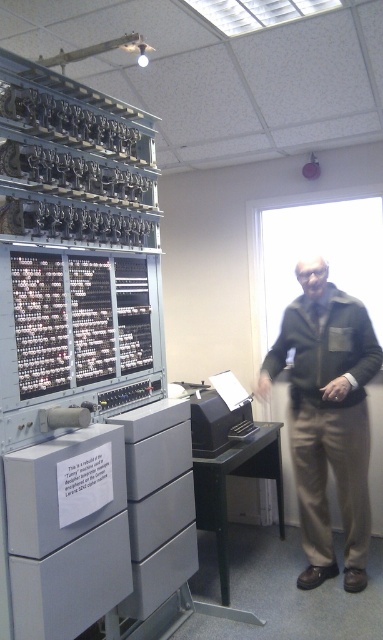
Between gray plastic drawer at lower center and black plastic printer at center, which one has less height?

With less height is gray plastic drawer at lower center.

Is gray plastic drawer at lower center to the right of black plastic printer at center from the viewer's perspective?

No, gray plastic drawer at lower center is not to the right of black plastic printer at center.

This screenshot has width=383, height=640. What are the coordinates of `gray plastic drawer at lower center` in the screenshot? It's located at (160, 573).

Is khaki cotton pants at right thinner than black plastic printer at center?

No.

Does khaki cotton pants at right appear on the left side of black plastic printer at center?

No, khaki cotton pants at right is not to the left of black plastic printer at center.

Is point (374, 333) farther from camera compared to point (222, 438)?

No, it is not.

The image size is (383, 640). Identify the location of khaki cotton pants at right. (327, 417).

Which is above, satin gray drawer at center or black plastic printer at center?

Positioned higher is black plastic printer at center.

Is point (186, 492) farther from viewer compared to point (212, 394)?

No, it is in front of (212, 394).

Find the location of a particular element. The width and height of the screenshot is (383, 640). satin gray drawer at center is located at coordinates (160, 516).